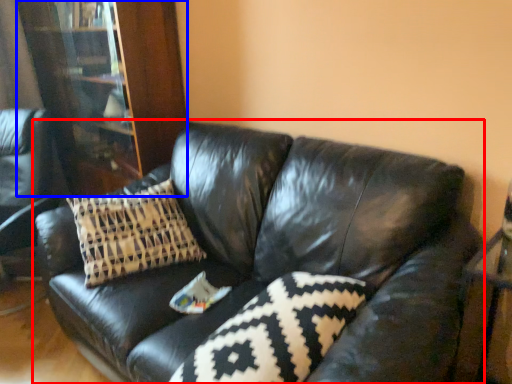
Question: Among these objects, which one is nearest to the camera, studio couch (highlighted by a red box) or bookcase (highlighted by a blue box)?

Choices:
 (A) studio couch
 (B) bookcase

Answer: (A)